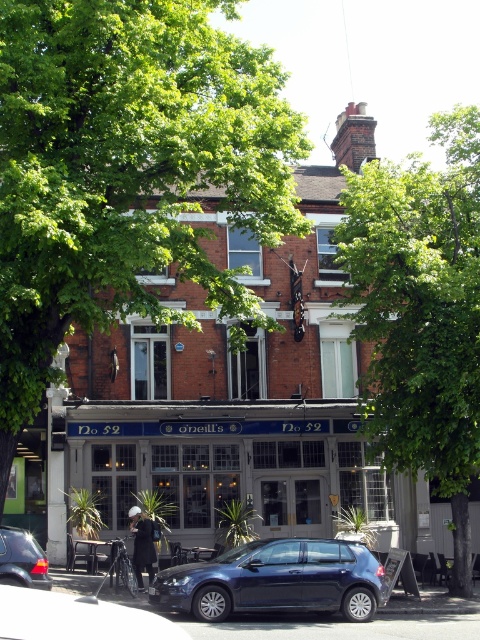
This screenshot has width=480, height=640. What do you see at coordinates (276, 580) in the screenshot? I see `glossy metallic hatchback at lower center` at bounding box center [276, 580].

Is glossy metallic hatchback at lower center wider than metallic blue car at lower left?

Indeed, glossy metallic hatchback at lower center has a greater width compared to metallic blue car at lower left.

Is point (314, 576) farther from viewer compared to point (14, 556)?

Yes, point (314, 576) is farther from viewer.

Where is `glossy metallic hatchback at lower center`? This screenshot has height=640, width=480. glossy metallic hatchback at lower center is located at coordinates (276, 580).

Does green leafy tree at upper left have a smaller size compared to metallic blue car at lower left?

Incorrect, green leafy tree at upper left is not smaller in size than metallic blue car at lower left.

Does green leafy tree at upper left appear under metallic blue car at lower left?

Actually, green leafy tree at upper left is above metallic blue car at lower left.

Is point (4, 467) closer to viewer compared to point (12, 579)?

No, it is behind (12, 579).

This screenshot has width=480, height=640. I want to click on green leafy tree at upper left, so click(126, 172).

Between glossy metallic hatchback at lower center and dark blue jeans at center, which one has more height?

With more height is dark blue jeans at center.

Which is in front, point (362, 586) or point (133, 566)?

Point (362, 586) is in front.

At what (x,y) coordinates should I click in order to perform the action: click on glossy metallic hatchback at lower center. Please return your answer as a coordinate pair (x, y). Looking at the image, I should click on (276, 580).

You are a GUI agent. You are given a task and a screenshot of the screen. Output one action in this format:
    pyautogui.click(x=<x>, y=<y>)
    Task: Click on the glossy metallic hatchback at lower center
    The height and width of the screenshot is (640, 480).
    Given the screenshot: What is the action you would take?
    pyautogui.click(x=276, y=580)